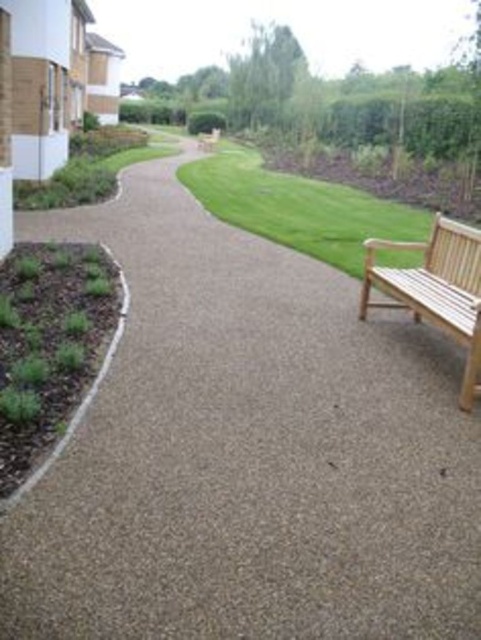
Question: Among these objects, which one is farthest from the camera?

Choices:
 (A) light brown wooden bench at right
 (B) green grass at center

Answer: (B)

Question: Which is farther from the green grass at center?

Choices:
 (A) light brown wooden bench at right
 (B) dark brown mulch at lower left

Answer: (B)

Question: Is green grass at center to the right of light brown wooden bench at right from the viewer's perspective?

Choices:
 (A) yes
 (B) no

Answer: (B)

Question: From the image, what is the correct spatial relationship of green grass at center in relation to light brown wooden bench at right?

Choices:
 (A) left
 (B) right

Answer: (A)

Question: Is dark brown mulch at lower left to the right of green grass at center from the viewer's perspective?

Choices:
 (A) no
 (B) yes

Answer: (A)

Question: Which point appears farthest from the camera in this image?

Choices:
 (A) (53, 300)
 (B) (217, 209)

Answer: (B)